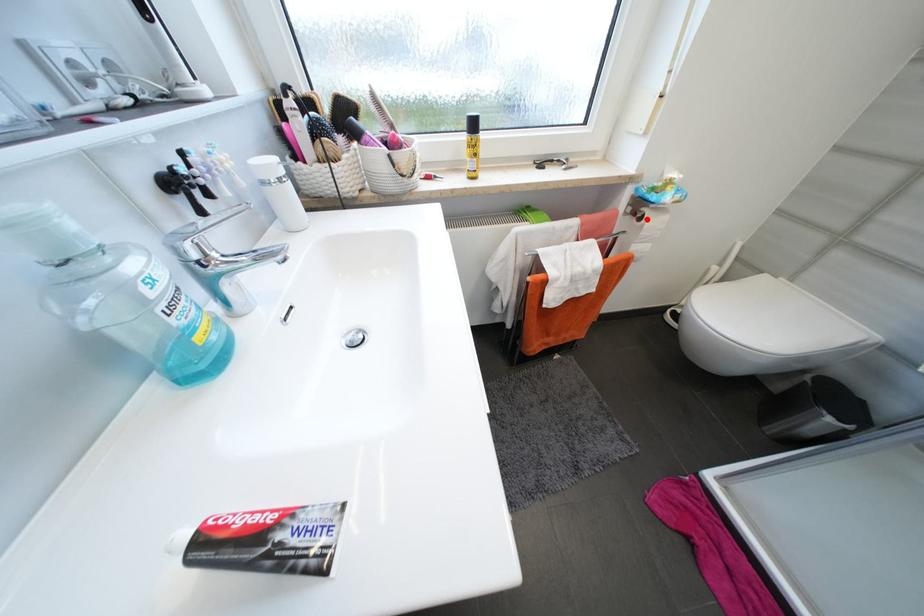
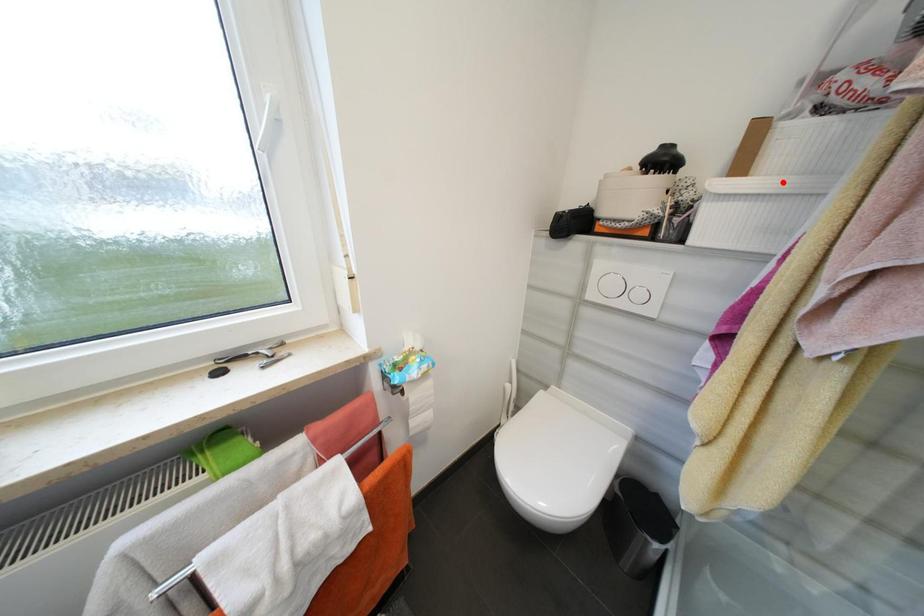
I am providing you with two images of the same scene from different viewpoints. A red point is marked on the first image and another point is marked on the second image. Does the point marked in image1 correspond to the same location as the one in image2?

No